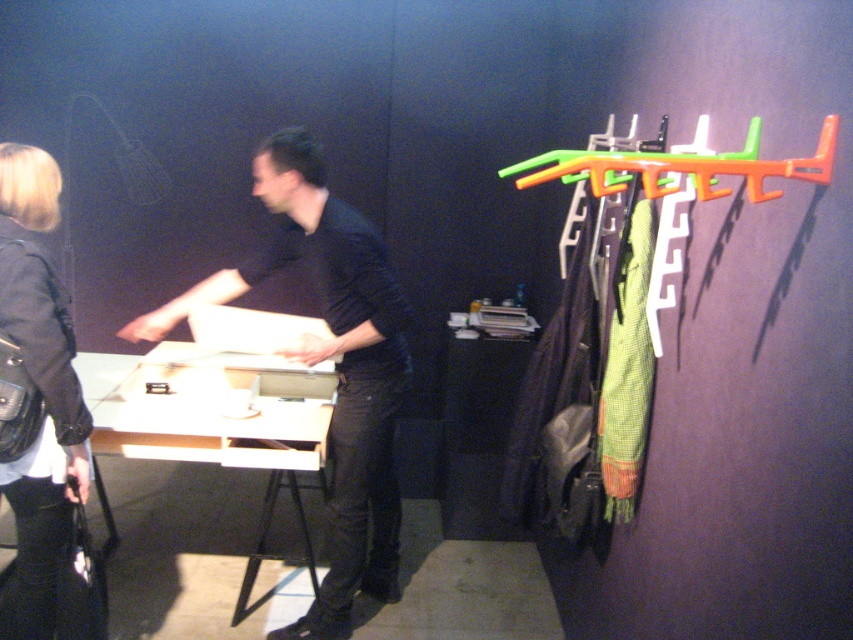
Question: In this image, where is black leather jacket at lower left located relative to orange plastic hanger at right?

Choices:
 (A) above
 (B) below

Answer: (B)

Question: Which point is closer to the camera?

Choices:
 (A) (119, 376)
 (B) (305, 134)
 (C) (67, 346)
 (D) (753, 180)

Answer: (D)

Question: Which of these objects is positioned closest to the orange plastic hanger at right?

Choices:
 (A) matte black shirt at center
 (B) black leather jacket at lower left
 (C) white matte table at center

Answer: (A)

Question: Is matte black shirt at center above white matte table at center?

Choices:
 (A) no
 (B) yes

Answer: (B)

Question: Considering the real-world distances, which object is farthest from the white matte table at center?

Choices:
 (A) matte black shirt at center
 (B) orange plastic hanger at right
 (C) black leather jacket at lower left

Answer: (B)

Question: Can you confirm if black leather jacket at lower left is positioned above white matte table at center?

Choices:
 (A) no
 (B) yes

Answer: (B)